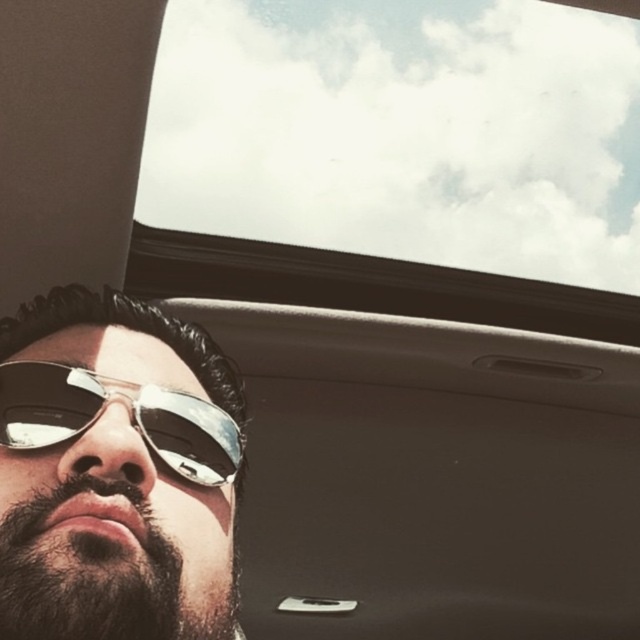
Is point (97, 602) more distant than point (198, 470)?

That is False.

Who is more distant from viewer, [96,586] or [227,432]?

Point [227,432]

You are a GUI agent. You are given a task and a screenshot of the screen. Output one action in this format:
    pyautogui.click(x=<x>, y=<y>)
    Task: Click on the dark brown fuzzy beard at lower left
    
    Given the screenshot: What is the action you would take?
    pyautogui.click(x=96, y=579)

Who is more forward, (598, 257) or (100, 502)?

Positioned in front is point (100, 502).

In the scene shown: Measure the distance between transparent glass car window at upper center and shiny metallic sunglasses at lower left.

transparent glass car window at upper center is 3.90 feet away from shiny metallic sunglasses at lower left.

This screenshot has height=640, width=640. What are the coordinates of `transparent glass car window at upper center` in the screenshot? It's located at (396, 161).

Is transparent glass car window at upper center shorter than metallic reflective sunglasses at lower left?

In fact, transparent glass car window at upper center may be taller than metallic reflective sunglasses at lower left.

Between point (177, 106) and point (216, 410), which one is positioned behind?

Point (177, 106)

You are a GUI agent. You are given a task and a screenshot of the screen. Output one action in this format:
    pyautogui.click(x=<x>, y=<y>)
    Task: Click on the transparent glass car window at upper center
    The image size is (640, 640).
    Given the screenshot: What is the action you would take?
    pyautogui.click(x=396, y=161)